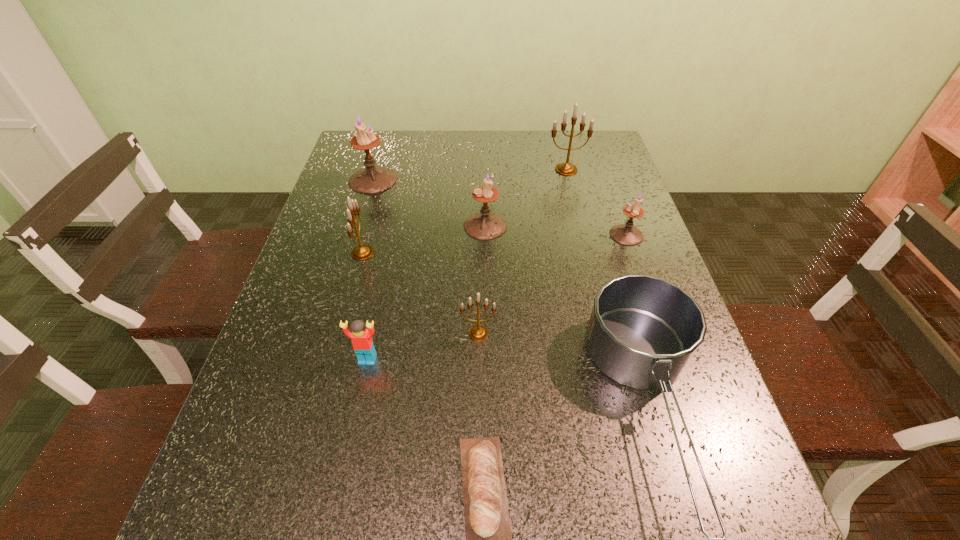
Identify which object is the closest to the second biggest gold candelabrum. Please provide its 2D coordinates. Your answer should be formatted as a tuple, i.e. [(x, y)], where the tuple contains the x and y coordinates of a point satisfying the conditions above.

[(372, 179)]

Find the location of a particular element. the second closest candelabrum to the second gold candelabrum from left to right is located at coordinates (361, 252).

Identify the location of candelabrum that can be found as the second closest to the rightmost gold candelabrum. Image resolution: width=960 pixels, height=540 pixels. (627, 234).

Identify which purple candle holder is located as the third nearest to the second candelabrum from right to left. Please provide its 2D coordinates. Your answer should be formatted as a tuple, i.e. [(x, y)], where the tuple contains the x and y coordinates of a point satisfying the conditions above.

[(372, 179)]

Identify which purple candle holder is the closest to the second smallest purple candle holder. Please provide its 2D coordinates. Your answer should be formatted as a tuple, i.e. [(x, y)], where the tuple contains the x and y coordinates of a point satisfying the conditions above.

[(372, 179)]

Locate which gold candelabrum ranks in proximity to the leftmost gold candelabrum. Please provide its 2D coordinates. Your answer should be formatted as a tuple, i.e. [(x, y)], where the tuple contains the x and y coordinates of a point satisfying the conditions above.

[(478, 332)]

Locate an element on the screen. The image size is (960, 540). gold candelabrum object that ranks as the closest to the fifth candelabrum from left to right is located at coordinates (361, 252).